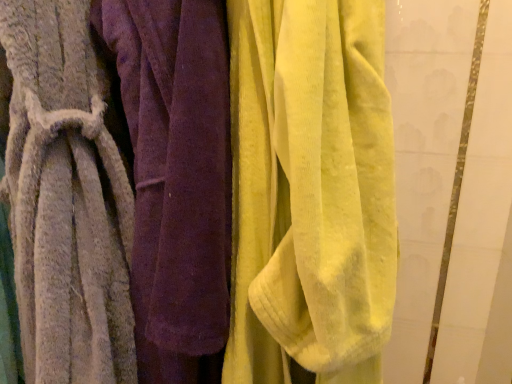
Question: Is soft gray towel at left, which is the second towel in left-to-right order, inside the boundaries of gray textured towel at left, the third towel when ordered from right to left, or outside?

Choices:
 (A) outside
 (B) inside

Answer: (B)

Question: Is soft gray towel at left, which is the second towel in left-to-right order, bigger or smaller than gray textured towel at left, which ranks as the 1th towel in left-to-right order?

Choices:
 (A) small
 (B) big

Answer: (A)

Question: Which object is positioned closest to the velvet yellow towel at center, the 3th towel when ordered from left to right?

Choices:
 (A) gray textured towel at left, the third towel when ordered from right to left
 (B) soft gray towel at left, which is the second towel in left-to-right order

Answer: (B)

Question: Which of these objects is positioned closest to the soft gray towel at left, which is the second towel in left-to-right order?

Choices:
 (A) gray textured towel at left, which ranks as the 1th towel in left-to-right order
 (B) velvet yellow towel at center, positioned as the 1th towel in right-to-left order

Answer: (A)